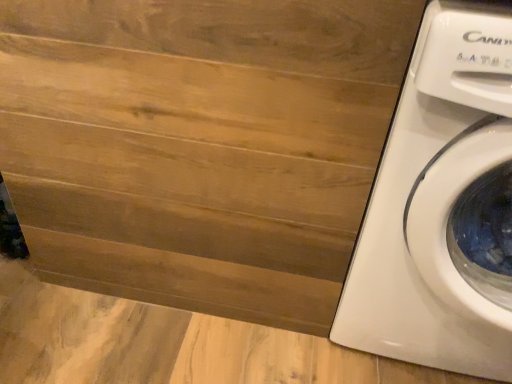
Locate an element on the screen. Image resolution: width=512 pixels, height=384 pixels. white glossy washing machine at right is located at coordinates (441, 206).

The width and height of the screenshot is (512, 384). Describe the element at coordinates (441, 206) in the screenshot. I see `white glossy washing machine at right` at that location.

What is the approximate width of white glossy washing machine at right?

white glossy washing machine at right is 21.90 inches in width.

This screenshot has width=512, height=384. What are the coordinates of `white glossy washing machine at right` in the screenshot? It's located at pos(441,206).